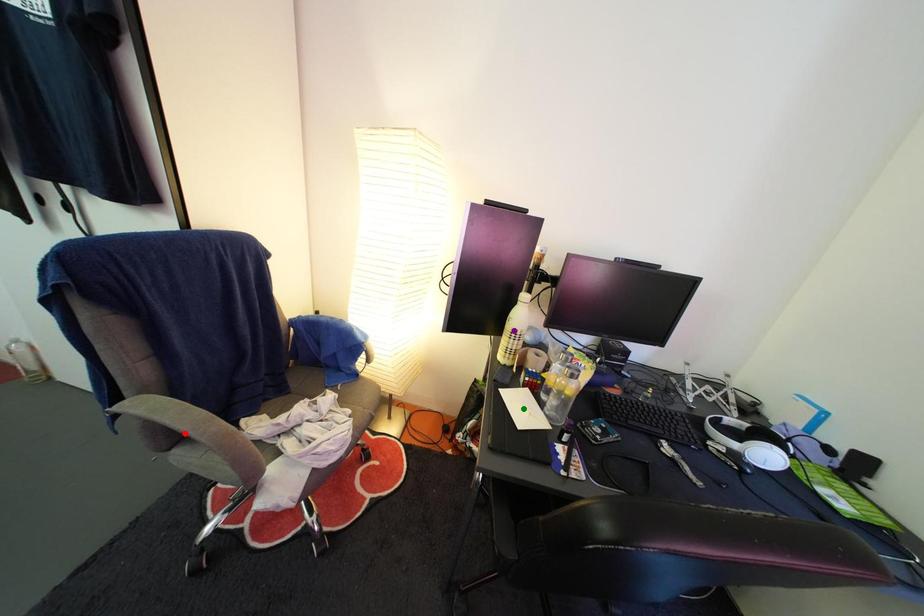
Order these from farthest to nearest:
purple point, red point, green point

purple point < green point < red point